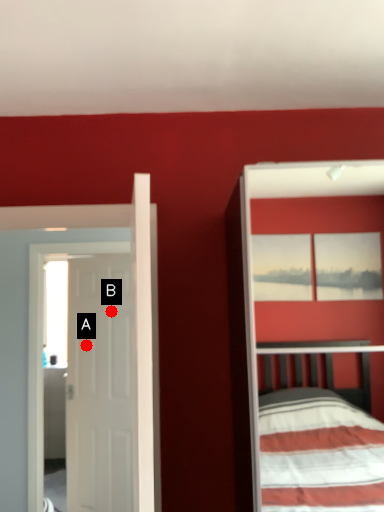
Question: Two points are circled on the image, labeled by A and B beside each circle. Which point is farther to the camera?

Choices:
 (A) A is further
 (B) B is further

Answer: (A)